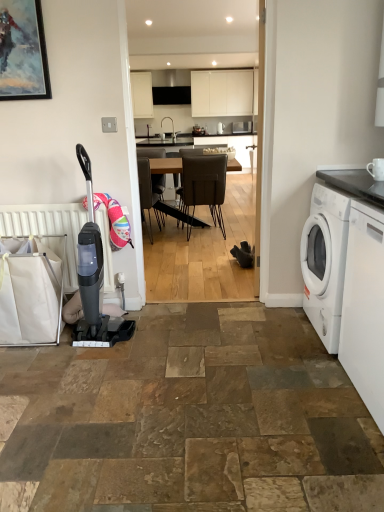
Question: Looking at the image, does wooden table at center seem bigger or smaller compared to brown leather chair at center?

Choices:
 (A) small
 (B) big

Answer: (B)

Question: Is wooden table at center in front of or behind brown leather chair at center in the image?

Choices:
 (A) behind
 (B) front

Answer: (A)

Question: Based on their relative distances, which object is farther from the black granite countertop at right?

Choices:
 (A) white matte cabinet at upper center, acting as the 1th cabinetry starting from the right
 (B) wooden table at center
 (C) white glossy washing machine at right, the first washing machine viewed from the front
 (D) brown leather chair at center
 (E) white matte cabinet at upper center, the 2th cabinetry from the right

Answer: (E)

Question: Which is nearer to the white matte cabinet at upper center, the 2th cabinetry from the right?

Choices:
 (A) white ceramic mug at upper right
 (B) metallic painting at upper left
 (C) black matte exhaust hood at upper center
 (D) white matte cabinet at upper center, acting as the 1th cabinetry starting from the right
 (E) wooden table at center

Answer: (C)